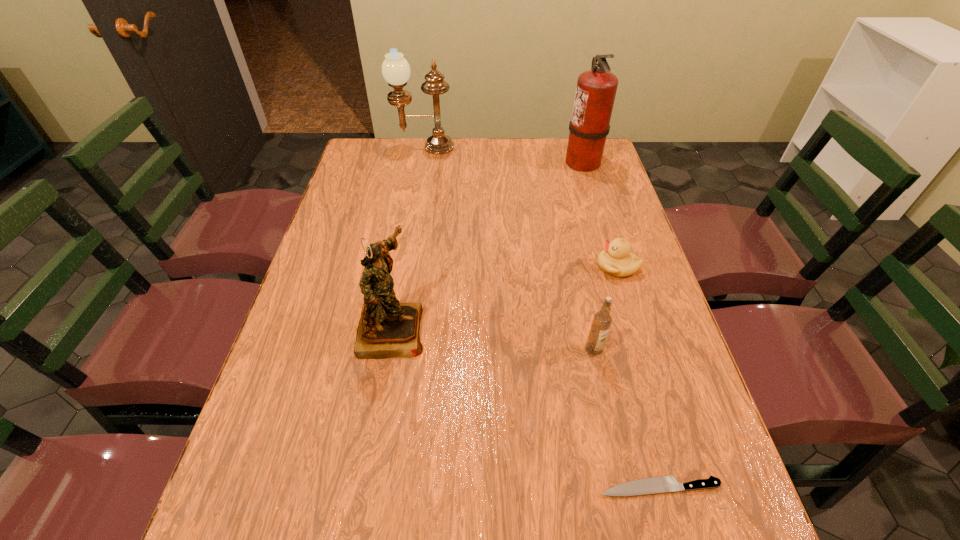
At what (x,y) coordinates should I click in order to perform the action: click on object that ranks as the closest to the fire extinguisher. Please return your answer as a coordinate pair (x, y). The width and height of the screenshot is (960, 540). Looking at the image, I should click on click(616, 259).

Identify the location of the fourth closest object to the third shortest object. Image resolution: width=960 pixels, height=540 pixels. (596, 89).

Where is `vacant space that satisfies the following two spatial constraints: 1. on the front-facing side of the nearest object; 2. on the left side of the figurine`? This screenshot has height=540, width=960. vacant space that satisfies the following two spatial constraints: 1. on the front-facing side of the nearest object; 2. on the left side of the figurine is located at coordinates (364, 487).

The image size is (960, 540). Identify the location of vacant space that satisfies the following two spatial constraints: 1. on the front-facing side of the duckling; 2. on the label of the fourth tallest object. coord(643,349).

Find the location of a particular element. This screenshot has width=960, height=540. free space that satisfies the following two spatial constraints: 1. on the front-facing side of the shortest object; 2. on the left side of the figurine is located at coordinates (364, 487).

This screenshot has height=540, width=960. In order to click on vacant space that satisfies the following two spatial constraints: 1. on the front-facing side of the nearest object; 2. on the right side of the figurine in this screenshot , I will do `click(364, 487)`.

The height and width of the screenshot is (540, 960). In order to click on free space in the image that satisfies the following two spatial constraints: 1. toward the nozzle of the fire extinguisher; 2. on the label of the fourth tallest object in this screenshot , I will do `click(639, 349)`.

Where is `vacant space that satisfies the following two spatial constraints: 1. on the label of the vodka; 2. on the left side of the nearest object`? The height and width of the screenshot is (540, 960). vacant space that satisfies the following two spatial constraints: 1. on the label of the vodka; 2. on the left side of the nearest object is located at coordinates (623, 487).